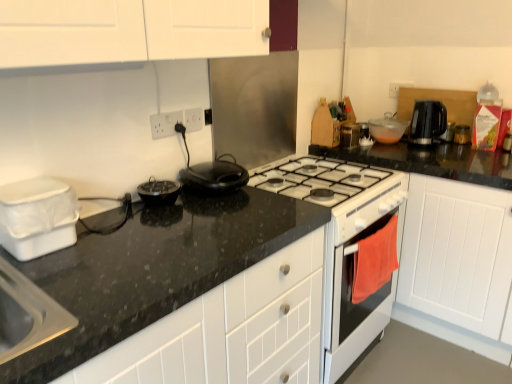
Question: Is point (35, 230) closer or farther from the camera than point (80, 382)?

Choices:
 (A) closer
 (B) farther

Answer: (B)

Question: From a real-world perspective, is white plastic container at left, placed as the seventh kitchen appliance when sorted from right to left, positioned above or below black granite countertop at center?

Choices:
 (A) above
 (B) below

Answer: (A)

Question: Which object is positioned closest to the translucent glass bowl at upper right, the 6th kitchen appliance in the front-to-back sequence?

Choices:
 (A) metallic silver toaster at upper right, marked as the 1th kitchen appliance in a back-to-front arrangement
 (B) black plastic kettle at upper right, the 6th kitchen appliance when ordered from left to right
 (C) black granite countertop at center
 (D) black plastic kettle at upper right, the 1th appliance in the back-to-front sequence
 (E) black matte waffle maker at center, marked as the third kitchen appliance in a front-to-back arrangement

Answer: (B)

Question: Based on their relative distances, which object is nearer to the white plastic electric outlet at upper center, placed as the first electric outlet when sorted from right to left?

Choices:
 (A) black plastic kettle at upper right, which is counted as the 2th appliance, starting from the left
 (B) black granite countertop at center
 (C) metallic silver toaster at upper right, the 7th kitchen appliance from the front
 (D) white plastic container at left, which appears as the first kitchen appliance when viewed from the left
 (E) white plastic electric outlet at upper center, which is the 2th electric outlet from right to left

Answer: (E)